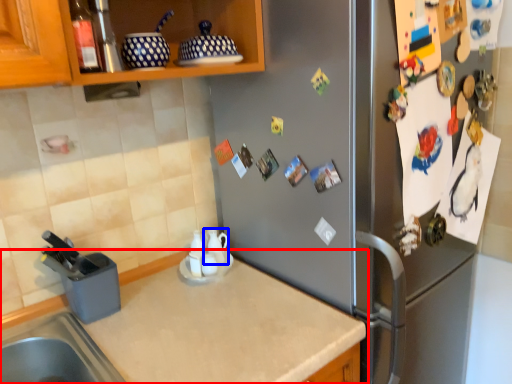
Question: Among these objects, which one is nearest to the camera, countertop (highlighted by a red box) or tea pot (highlighted by a blue box)?

Choices:
 (A) countertop
 (B) tea pot

Answer: (A)